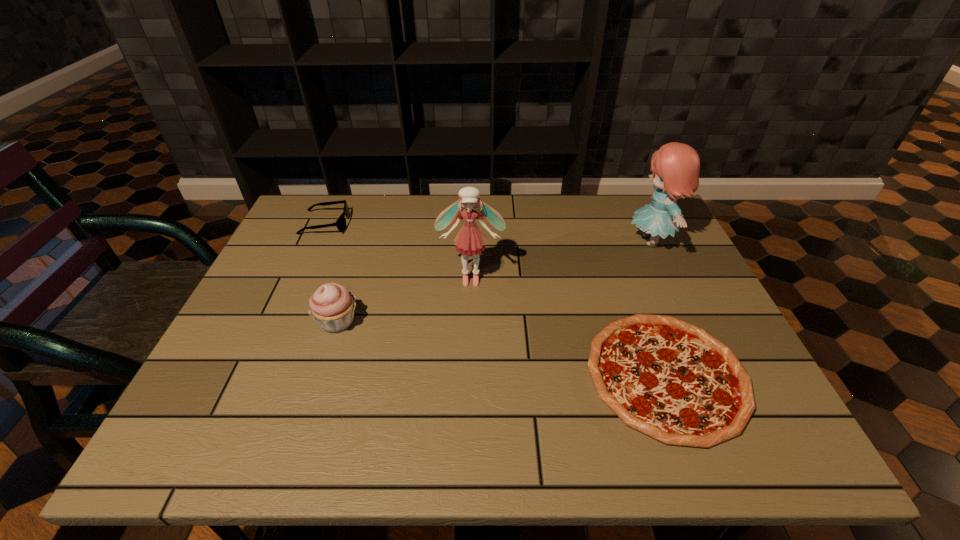
Locate an element on the screen. Image resolution: width=960 pixels, height=540 pixels. free space that is in between the leftmost object and the right doll is located at coordinates (489, 232).

Locate an element on the screen. vacant space that's between the pizza and the third object from left to right is located at coordinates (568, 327).

Locate an element on the screen. free space that is in between the cupcake and the right doll is located at coordinates (494, 281).

The image size is (960, 540). I want to click on free space that is in between the third object from right to left and the shortest object, so click(x=568, y=327).

Locate an element on the screen. The height and width of the screenshot is (540, 960). vacant space in between the shortest object and the leftmost object is located at coordinates (496, 300).

I want to click on blank region between the third object from left to right and the pizza, so click(x=568, y=327).

This screenshot has height=540, width=960. I want to click on empty space that is in between the sunglasses and the right doll, so click(489, 232).

Where is `empty space between the fourth object from right to left and the leftmost object`? empty space between the fourth object from right to left and the leftmost object is located at coordinates (331, 273).

You are a GUI agent. You are given a task and a screenshot of the screen. Output one action in this format:
    pyautogui.click(x=<x>, y=<y>)
    Task: Click on the free spot between the sunglasses and the cupcake
    The image size is (960, 540).
    Given the screenshot: What is the action you would take?
    pyautogui.click(x=331, y=273)

Image resolution: width=960 pixels, height=540 pixels. What are the coordinates of `the closest object relative to the right doll` in the screenshot? It's located at (671, 380).